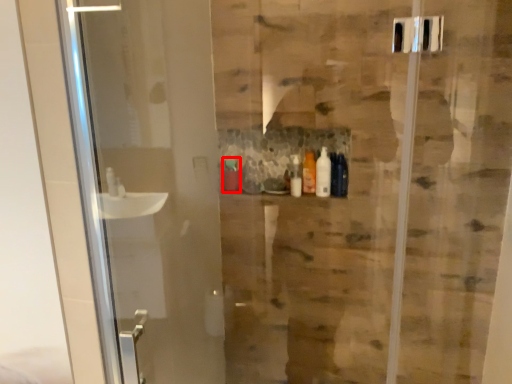
Question: From the image, what is the correct spatial relationship of toiletry (annotated by the red box) in relation to toiletry?

Choices:
 (A) left
 (B) right

Answer: (A)